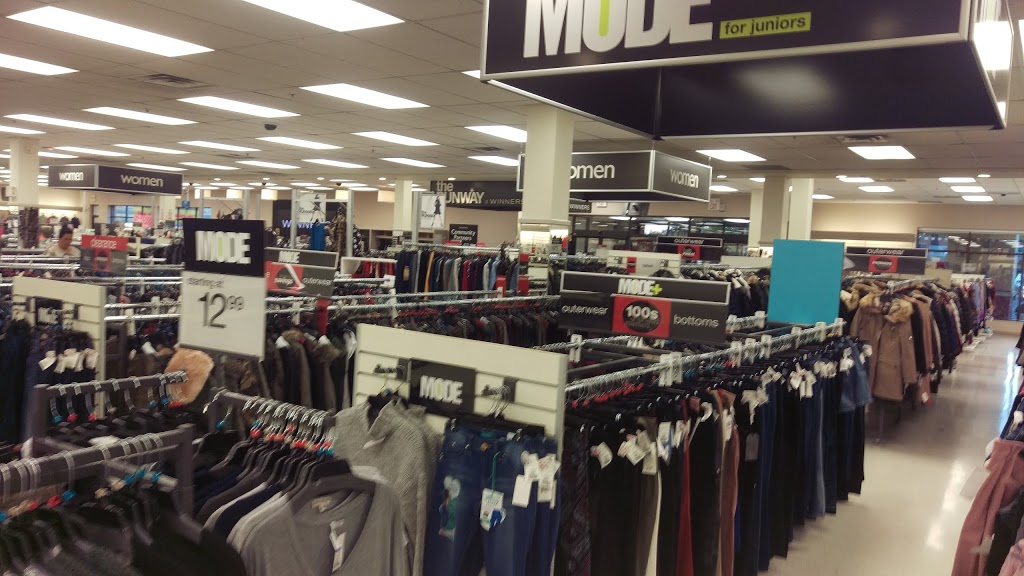
Image resolution: width=1024 pixels, height=576 pixels. I want to click on dressing rooms, so click(x=361, y=208), click(x=267, y=206), click(x=222, y=204).